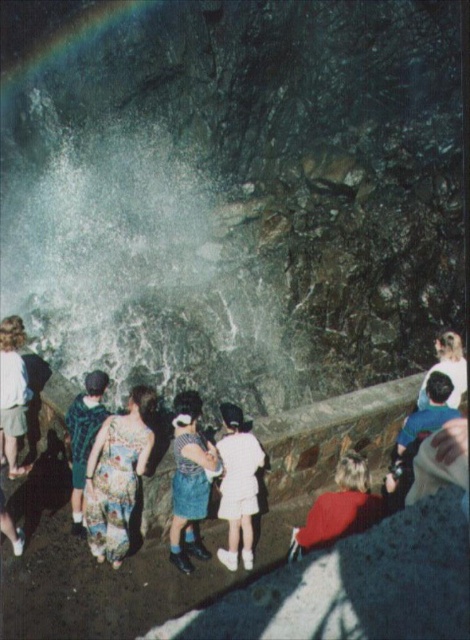
Question: Among these objects, which one is nearest to the camera?

Choices:
 (A) red wool sweater at center
 (B) floral fabric dress at center

Answer: (A)

Question: Can you confirm if floral fabric dress at center is positioned to the right of white matte dress at center?

Choices:
 (A) no
 (B) yes

Answer: (A)

Question: Considering the real-world distances, which object is farthest from the white matte shirt at right?

Choices:
 (A) white matte dress at center
 (B) denim skirt at center

Answer: (B)

Question: Estimate the real-world distances between objects in this image. Which object is closer to the denim skirt at center?

Choices:
 (A) green fabric dress at lower left
 (B) white cotton dress at lower left
 (C) floral fabric dress at center

Answer: (C)

Question: Considering the relative positions of white matte dress at center and green fabric dress at lower left in the image provided, where is white matte dress at center located with respect to green fabric dress at lower left?

Choices:
 (A) below
 (B) above

Answer: (A)

Question: Can you confirm if denim skirt at center is smaller than white matte dress at center?

Choices:
 (A) no
 (B) yes

Answer: (B)